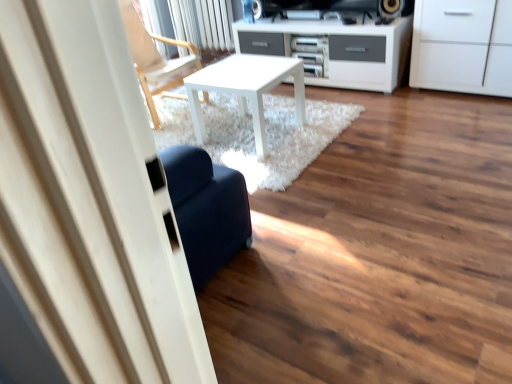
Question: Is white matte table at center looking in the opposite direction of white matte cabinet at upper right?

Choices:
 (A) yes
 (B) no

Answer: (B)

Question: Is white matte table at center at the left side of white matte cabinet at upper right?

Choices:
 (A) no
 (B) yes

Answer: (B)

Question: From a real-world perspective, is white matte table at center positioned under white matte cabinet at upper right based on gravity?

Choices:
 (A) yes
 (B) no

Answer: (A)

Question: Considering the relative positions of white matte table at center and white matte cabinet at upper right in the image provided, is white matte table at center behind white matte cabinet at upper right?

Choices:
 (A) yes
 (B) no

Answer: (B)

Question: Is white matte table at center wider than white matte cabinet at upper right?

Choices:
 (A) no
 (B) yes

Answer: (B)

Question: From the image's perspective, is white matte table at center below white matte cabinet at upper right?

Choices:
 (A) yes
 (B) no

Answer: (A)

Question: Is white matte table at center surrounded by wooden chair at upper left?

Choices:
 (A) no
 (B) yes

Answer: (A)

Question: Is wooden chair at upper left located outside white matte table at center?

Choices:
 (A) no
 (B) yes

Answer: (B)

Question: Is wooden chair at upper left turned away from white matte table at center?

Choices:
 (A) no
 (B) yes

Answer: (A)

Question: Can you confirm if wooden chair at upper left is taller than white matte table at center?

Choices:
 (A) no
 (B) yes

Answer: (B)

Question: Is the depth of wooden chair at upper left greater than that of white matte table at center?

Choices:
 (A) no
 (B) yes

Answer: (B)

Question: Does wooden chair at upper left touch white matte table at center?

Choices:
 (A) yes
 (B) no

Answer: (B)

Question: Is white matte cabinet at upper right oriented towards wooden chair at upper left?

Choices:
 (A) yes
 (B) no

Answer: (B)